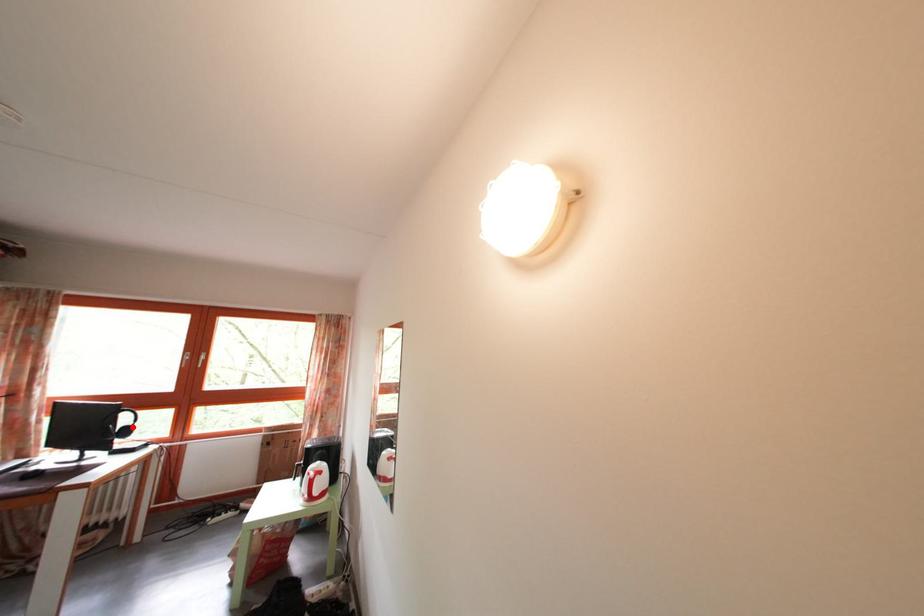
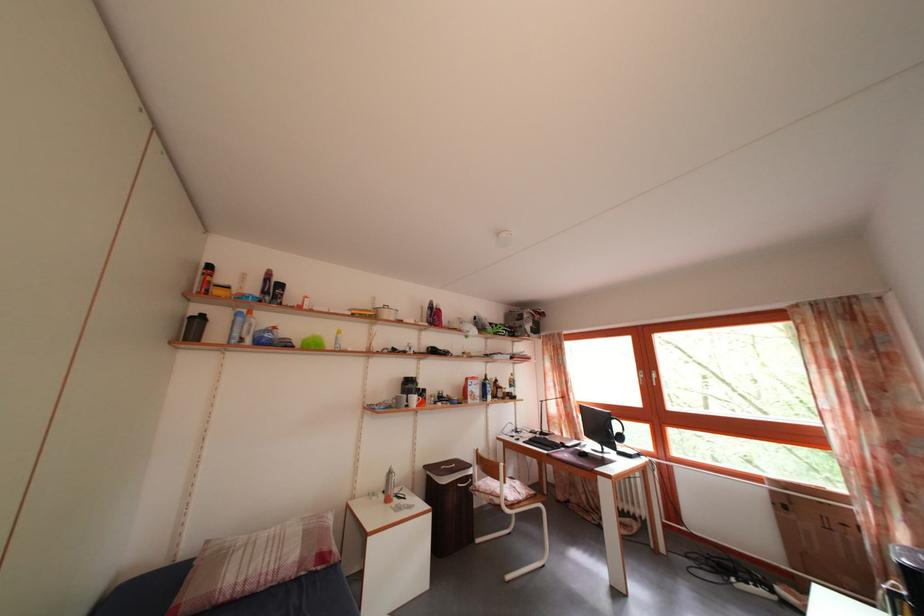
Question: I am providing you with two images of the same scene from different viewpoints. Given a red point in image1, look at the same physical point in image2. Is it:

Choices:
 (A) Closer to the viewpoint
 (B) Farther from the viewpoint

Answer: (B)